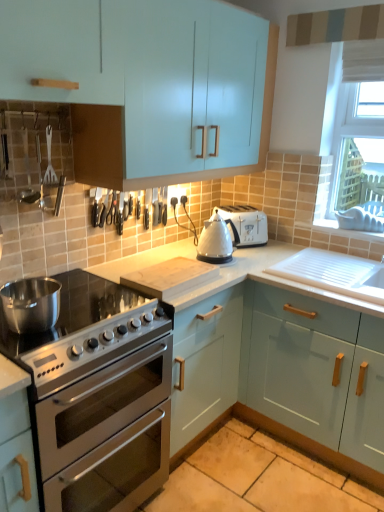
Question: Is matte light blue cabinet at center, which is the second cabinetry from top to bottom, behind wooden cutting board at center, placed as the second appliance when sorted from top to bottom?

Choices:
 (A) yes
 (B) no

Answer: (B)

Question: Can you confirm if matte light blue cabinet at center, the second cabinetry ordered from the bottom, is thinner than wooden cutting board at center, marked as the 1th appliance in a bottom-to-top arrangement?

Choices:
 (A) yes
 (B) no

Answer: (B)

Question: Would you consider matte light blue cabinet at center, the second cabinetry ordered from the bottom, to be distant from wooden cutting board at center, marked as the 1th appliance in a bottom-to-top arrangement?

Choices:
 (A) no
 (B) yes

Answer: (A)

Question: Is matte light blue cabinet at center, the second cabinetry ordered from the bottom, surrounding wooden cutting board at center, marked as the 1th appliance in a bottom-to-top arrangement?

Choices:
 (A) yes
 (B) no

Answer: (A)

Question: Does matte light blue cabinet at center, which is the second cabinetry from top to bottom, have a larger size compared to wooden cutting board at center, marked as the 1th appliance in a bottom-to-top arrangement?

Choices:
 (A) yes
 (B) no

Answer: (A)

Question: Is brushed metal spatula at upper left spatially inside light blue glossy cabinet at upper left, which is the first cabinetry from top to bottom, or outside of it?

Choices:
 (A) inside
 (B) outside

Answer: (A)

Question: Looking at the image, does brushed metal spatula at upper left seem bigger or smaller compared to light blue glossy cabinet at upper left, which is the first cabinetry from top to bottom?

Choices:
 (A) small
 (B) big

Answer: (A)

Question: Considering the positions of point (44, 182) and point (223, 65), is point (44, 182) closer or farther from the camera than point (223, 65)?

Choices:
 (A) closer
 (B) farther

Answer: (A)

Question: In terms of width, does brushed metal spatula at upper left look wider or thinner when compared to light blue glossy cabinet at upper left, which is the first cabinetry from top to bottom?

Choices:
 (A) wide
 (B) thin

Answer: (B)

Question: Considering the positions of point (349, 296) and point (71, 292), is point (349, 296) closer or farther from the camera than point (71, 292)?

Choices:
 (A) closer
 (B) farther

Answer: (B)

Question: Considering their positions, is matte light blue cabinet at center, which is the second cabinetry from top to bottom, located in front of or behind satin silver gas stove at lower left?

Choices:
 (A) behind
 (B) front

Answer: (B)

Question: Considering the positions of matte light blue cabinet at center, which is the second cabinetry from top to bottom, and satin silver gas stove at lower left in the image, is matte light blue cabinet at center, which is the second cabinetry from top to bottom, taller or shorter than satin silver gas stove at lower left?

Choices:
 (A) tall
 (B) short

Answer: (A)

Question: In the image, is matte light blue cabinet at center, the second cabinetry ordered from the bottom, on the left side or the right side of satin silver gas stove at lower left?

Choices:
 (A) left
 (B) right

Answer: (B)

Question: From the image's perspective, relative to light blue glossy cabinet at upper left, the third cabinetry positioned from the bottom, is white plastic window screen at upper right above or below?

Choices:
 (A) above
 (B) below

Answer: (B)

Question: Is white plastic window screen at upper right taller or shorter than light blue glossy cabinet at upper left, which is the first cabinetry from top to bottom?

Choices:
 (A) short
 (B) tall

Answer: (B)